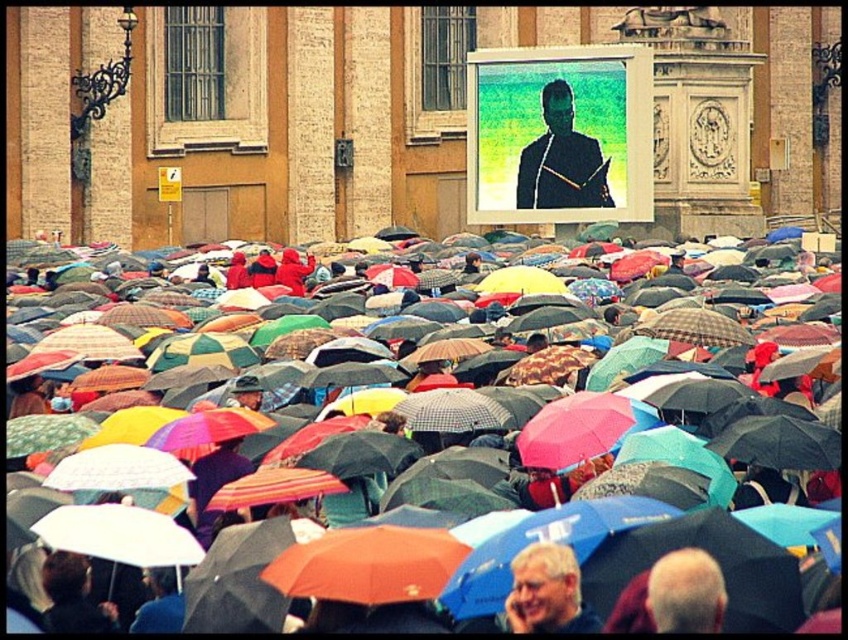
You are standing in the plaza and want to find the matte black umbrella at center. According to the coordinates given, where should you look relative to the large screen on the building?

The matte black umbrella at center is located at coordinates point 0.584 on the x axis and 0.757 on the y axis. Since the large screen is on the building in the background, the umbrella is positioned to the right and slightly above the screen.

Consider the image. You are a photographer trying to capture a clear shot of the large screen on the building. You notice the matte black umbrella at center and the matte gray hair at lower center are blocking your view. Which object is taller and therefore more likely to obstruct your camera lens?

The matte black umbrella at center is much taller than the matte gray hair at lower center, so it is more likely to obstruct your camera lens.